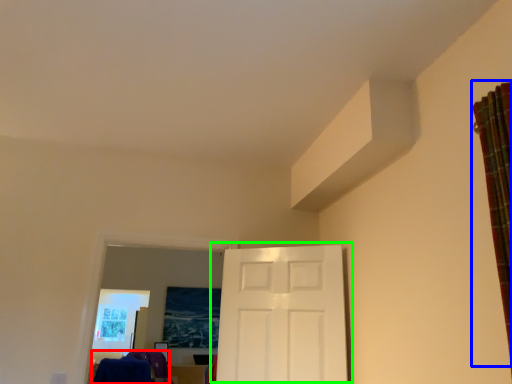
Question: Which object is positioned farthest from laundry (highlighted by a red box)? Select from curtain (highlighted by a blue box) and door (highlighted by a green box).

Choices:
 (A) curtain
 (B) door

Answer: (A)